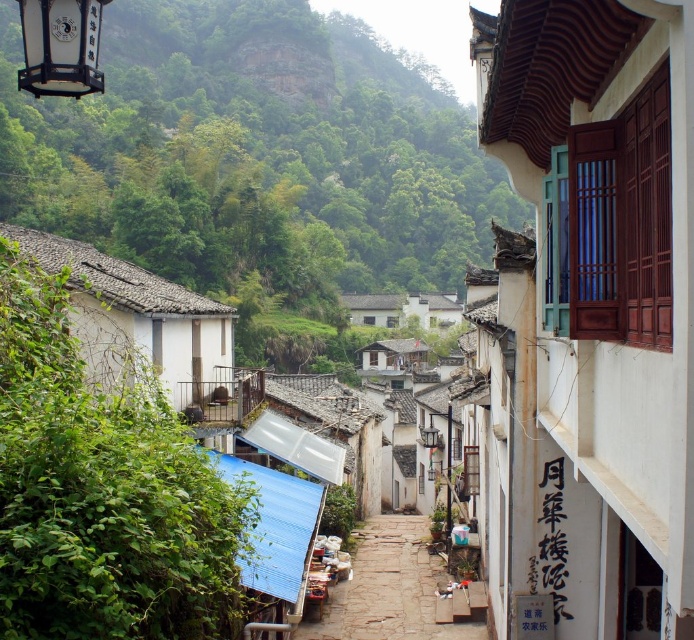
Find the location of a particular element. stone paved alley at center is located at coordinates (389, 588).

Does stone paved alley at center appear over matte black lantern at upper left?

No, stone paved alley at center is not above matte black lantern at upper left.

Measure the distance between point (471, 627) and camera.

Point (471, 627) and camera are 22.05 meters apart from each other.

Identify the location of stone paved alley at center. (389, 588).

Who is positioned more to the left, white wooden window at upper right or matte black lantern at upper left?

From the viewer's perspective, matte black lantern at upper left appears more on the left side.

Is point (666, 145) in front of point (53, 74)?

Yes.

At what (x,y) coordinates should I click in order to perform the action: click on white wooden window at upper right. Please return your answer as a coordinate pair (x, y). Looking at the image, I should click on (586, 321).

The image size is (694, 640). What do you see at coordinates (586, 321) in the screenshot?
I see `white wooden window at upper right` at bounding box center [586, 321].

Does point (686, 156) lie in front of point (480, 634)?

Yes, it is.

Find the location of a particular element. This screenshot has width=694, height=640. white wooden window at upper right is located at coordinates (586, 321).